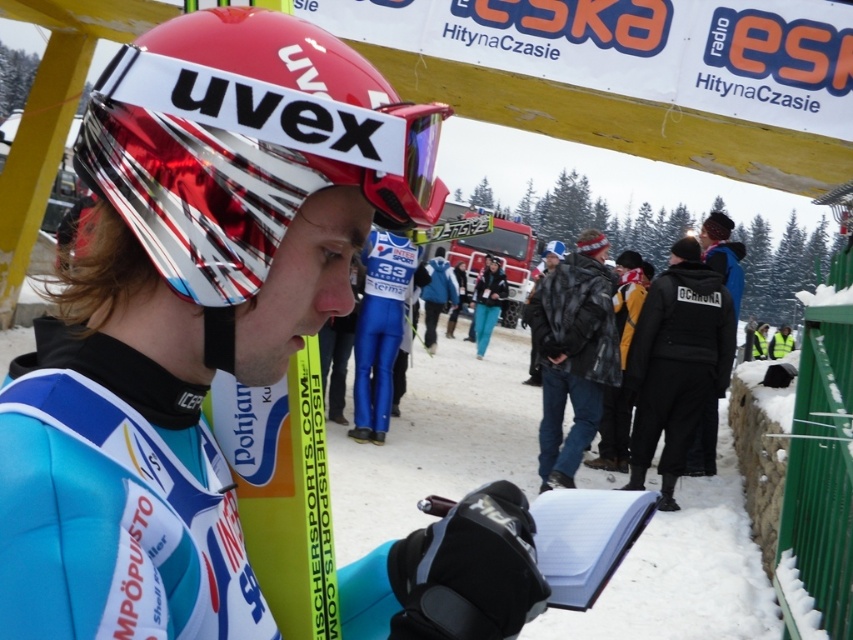
You are a photographer at the cross country skiing event. You need to take a photo of the transparent plastic goggles at center and the teal fabric pants at center. Which object will appear larger in the photo?

The transparent plastic goggles at center will appear larger in the photo because it is located above the teal fabric pants at center, which is closer to the camera.

What is located at the coordinates point (409, 170)?

Transparent plastic goggles at center is located at point (409, 170).

You are a photographer at the event and need to capture a clear photo of the transparent plastic goggles at center without the leather jacket at center blocking it. Is this possible given their current positions?

The transparent plastic goggles at center is behind the leather jacket at center, so it is blocked and cannot be captured clearly without moving the jacket.